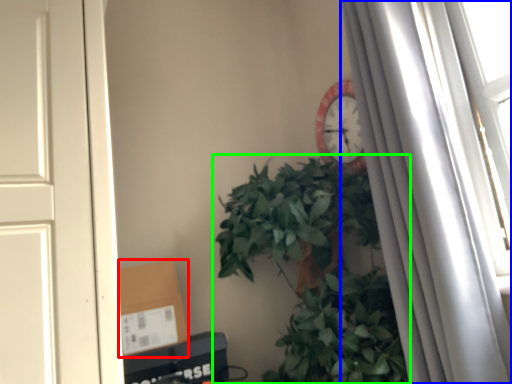
Question: Which is nearer to the cardboard box (highlighted by a red box)? curtain (highlighted by a blue box) or houseplant (highlighted by a green box).

Choices:
 (A) curtain
 (B) houseplant

Answer: (B)